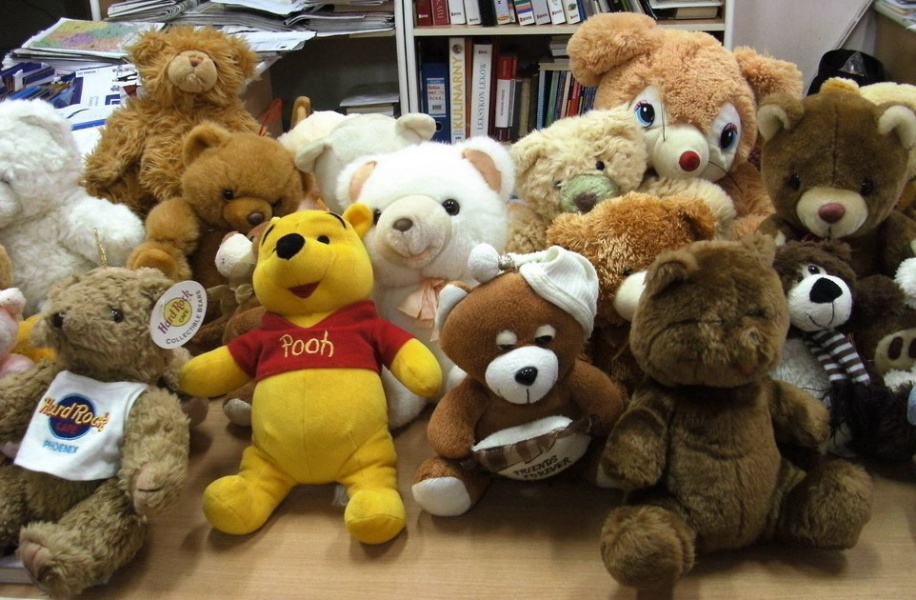
Where is `brown teddy bears`? This screenshot has width=916, height=600. brown teddy bears is located at coordinates (733, 388), (843, 262), (848, 166), (507, 316), (238, 171), (170, 115), (101, 345), (641, 231).